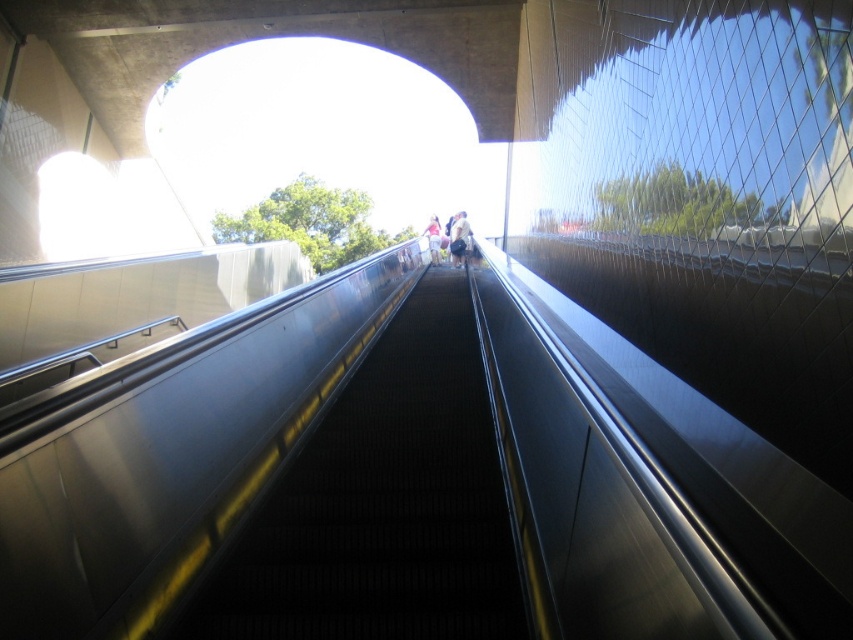
Which is more to the right, black rubber stairs at center or pink fabric at center?

pink fabric at center is more to the right.

Is black rubber stairs at center to the left of pink fabric at center from the viewer's perspective?

Yes, black rubber stairs at center is to the left of pink fabric at center.

Image resolution: width=853 pixels, height=640 pixels. In order to click on black rubber stairs at center in this screenshot , I will do `click(381, 502)`.

Is point (466, 216) in front of point (432, 250)?

Yes.

Who is positioned more to the right, light beige fabric bag at center or pink fabric at center?

From the viewer's perspective, light beige fabric bag at center appears more on the right side.

At what (x,y) coordinates should I click in order to perform the action: click on light beige fabric bag at center. Please return your answer as a coordinate pair (x, y). The image size is (853, 640). Looking at the image, I should click on (459, 237).

Locate an element on the screen. Image resolution: width=853 pixels, height=640 pixels. black rubber stairs at center is located at coordinates (381, 502).

Between black rubber stairs at center and light beige fabric bag at center, which one has more height?

light beige fabric bag at center is taller.

Which is behind, point (454, 368) or point (456, 253)?

The point (456, 253) is behind.

I want to click on black rubber stairs at center, so click(x=381, y=502).